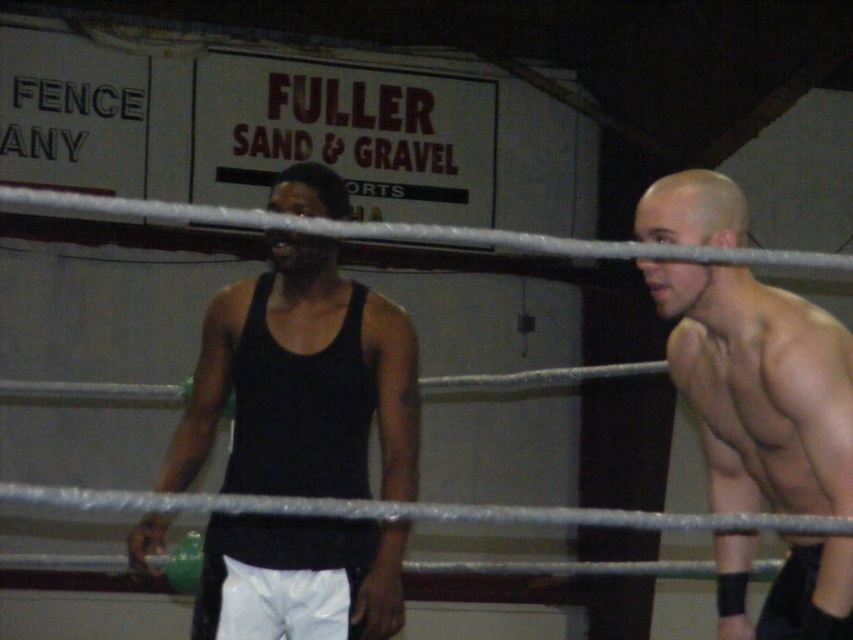
Question: Can you confirm if black matte tank top at center is positioned above muscular skin at right?

Choices:
 (A) no
 (B) yes

Answer: (B)

Question: Which object appears closest to the camera in this image?

Choices:
 (A) muscular skin at right
 (B) black matte tank top at center

Answer: (A)

Question: In this image, where is black matte tank top at center located relative to muscular skin at right?

Choices:
 (A) above
 (B) below

Answer: (A)

Question: Which point is closer to the camera taking this photo?

Choices:
 (A) (381, 429)
 (B) (785, 397)

Answer: (B)

Question: Does black matte tank top at center have a larger size compared to muscular skin at right?

Choices:
 (A) no
 (B) yes

Answer: (A)